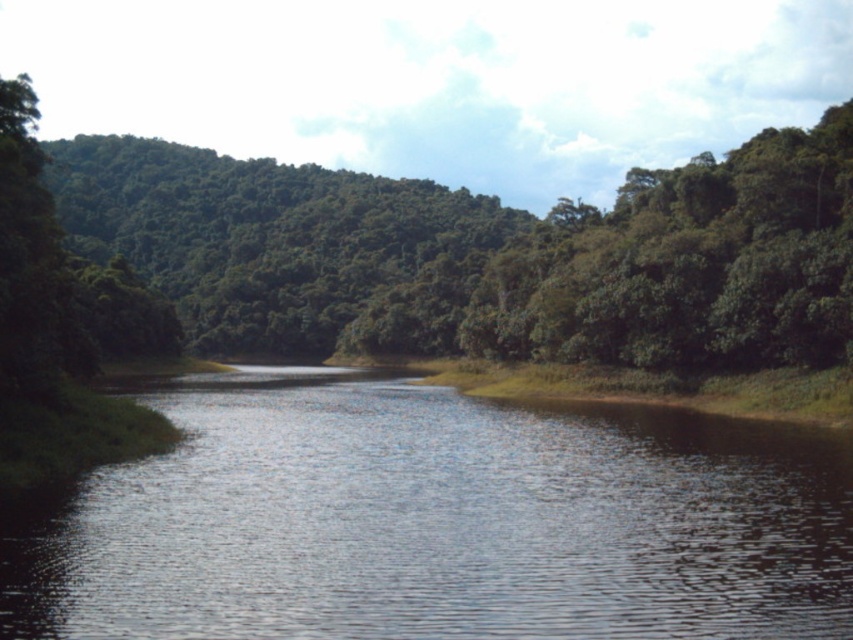
Can you confirm if shiny dark water at center is smaller than green leafy tree at center?

Yes.

Is shiny dark water at center shorter than green leafy tree at center?

Yes, shiny dark water at center is shorter than green leafy tree at center.

Where is `shiny dark water at center`? shiny dark water at center is located at coordinates (439, 522).

Image resolution: width=853 pixels, height=640 pixels. What are the coordinates of `shiny dark water at center` in the screenshot? It's located at (439, 522).